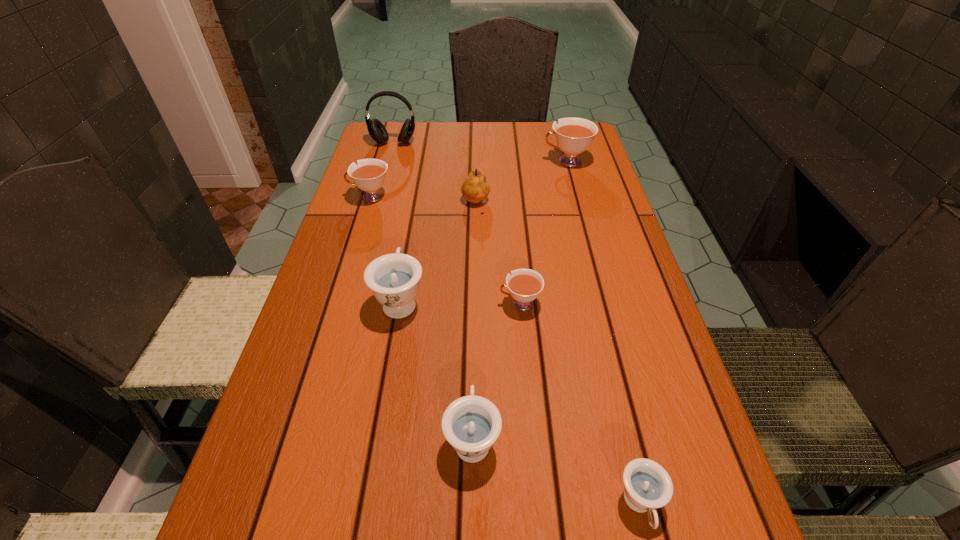
Identify the location of the second blue teacup from left to right. Image resolution: width=960 pixels, height=540 pixels. (471, 424).

The width and height of the screenshot is (960, 540). Identify the location of the fourth teacup from left to right. (524, 285).

I want to click on the nearest white teacup, so click(524, 285).

Find the location of a particular element. This screenshot has height=540, width=960. the smallest blue teacup is located at coordinates (647, 485).

You are a GUI agent. You are given a task and a screenshot of the screen. Output one action in this format:
    pyautogui.click(x=<x>, y=<y>)
    Task: Click on the free space located 0.170m on the ear cups of the black headset
    The image size is (960, 540).
    Given the screenshot: What is the action you would take?
    pyautogui.click(x=384, y=178)

The image size is (960, 540). I want to click on free space located 0.370m on the side of the farthest teacup with the handle, so click(422, 161).

You are a GUI agent. You are given a task and a screenshot of the screen. Output one action in this format:
    pyautogui.click(x=<x>, y=<y>)
    Task: Click on the free space located on the side of the farthest teacup with the handle
    Image resolution: width=960 pixels, height=540 pixels.
    Given the screenshot: What is the action you would take?
    pyautogui.click(x=520, y=161)

At what (x,y) coordinates should I click in order to perform the action: click on vacant point located 0.390m on the side of the farthest teacup with the handle. Please return your answer as a coordinate pair (x, y). The image size is (960, 540). Looking at the image, I should click on (417, 161).

The height and width of the screenshot is (540, 960). I want to click on free location located 0.090m on the side of the leftmost blue teacup with the handle, so click(x=409, y=250).

Where is `vacant space located 0.330m on the side of the leftmost blue teacup with the handle`? vacant space located 0.330m on the side of the leftmost blue teacup with the handle is located at coordinates click(x=419, y=193).